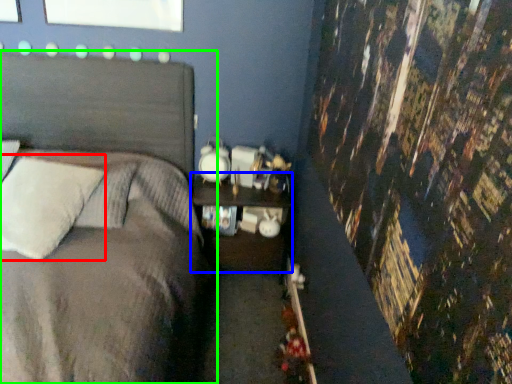
Question: Estimate the real-world distances between objects in this image. Which object is closer to pillow (highlighted by a red box), nightstand (highlighted by a blue box) or bed (highlighted by a green box)?

Choices:
 (A) nightstand
 (B) bed

Answer: (B)